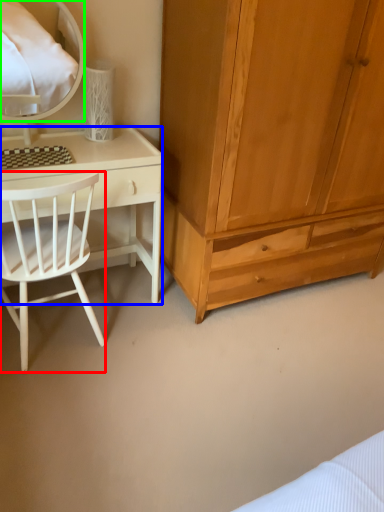
Question: Based on their relative distances, which object is nearer to chair (highlighted by a red box)? Choose from desk (highlighted by a blue box) and mirror (highlighted by a green box).

Choices:
 (A) desk
 (B) mirror

Answer: (A)